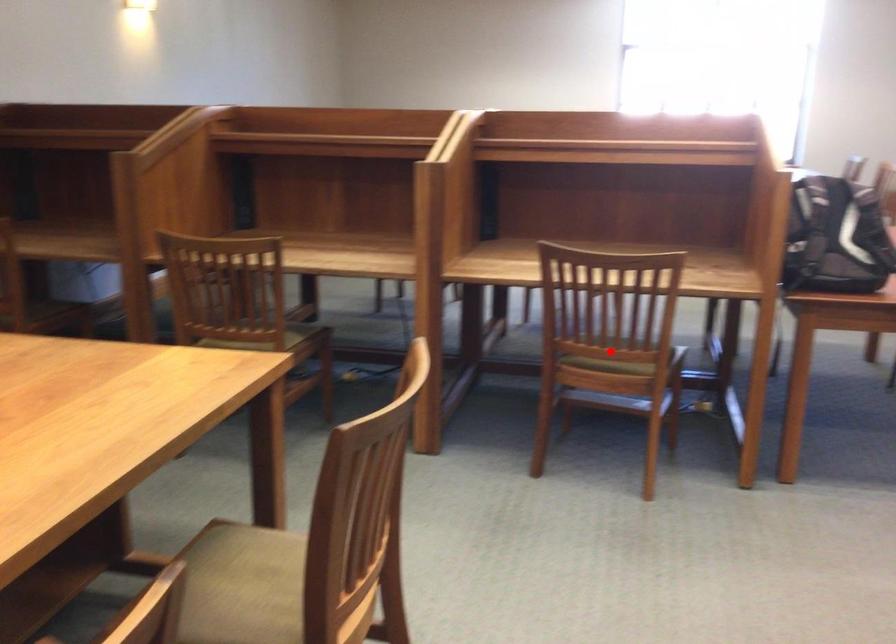
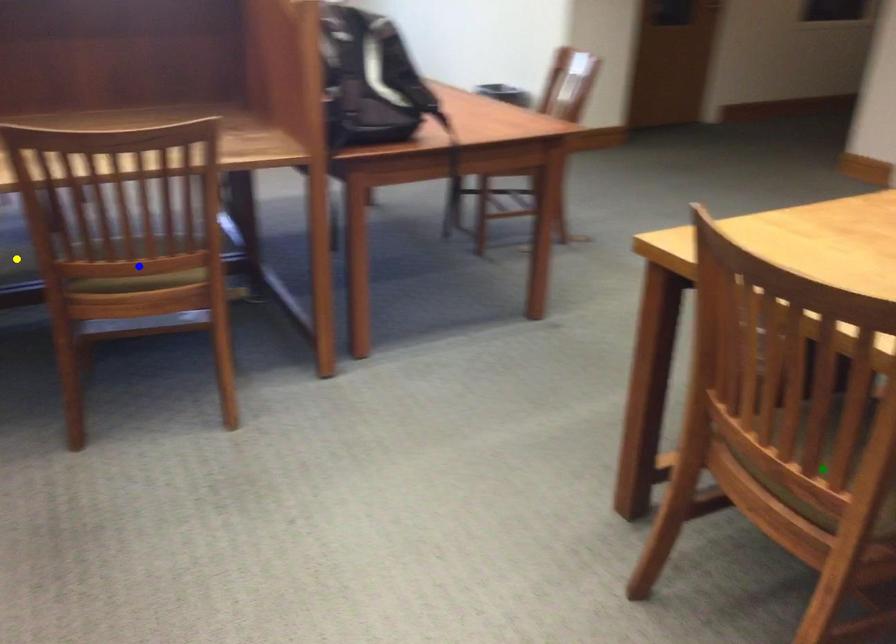
Question: I am providing you with two images of the same scene from different viewpoints. A red point is marked on the first image. You are given multiple points on the second image. Can you choose the point in image 2 that corresponds to the point in image 1?

Choices:
 (A) blue point
 (B) green point
 (C) yellow point

Answer: (A)